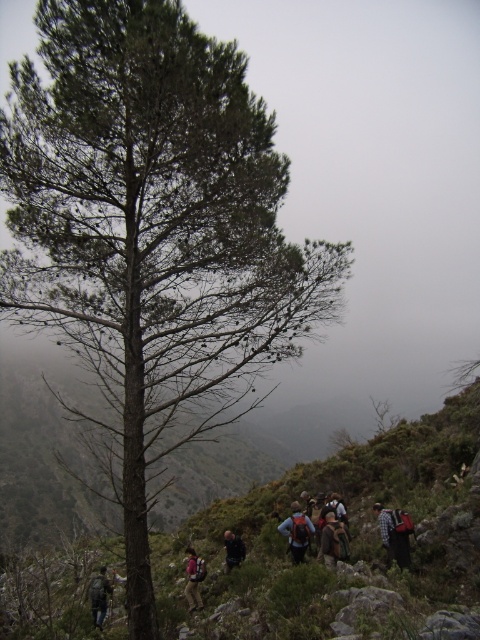
Can you confirm if green rough bark tree at center is wider than red backpack at lower right?

Indeed, green rough bark tree at center has a greater width compared to red backpack at lower right.

What are the coordinates of `green rough bark tree at center` in the screenshot? It's located at (152, 236).

The image size is (480, 640). I want to click on green rough bark tree at center, so click(152, 236).

Who is positioned more to the left, dark blue backpack at center or plaid flannel shirt at lower right?

dark blue backpack at center is more to the left.

Is dark blue backpack at center wider than plaid flannel shirt at lower right?

Yes, dark blue backpack at center is wider than plaid flannel shirt at lower right.

Does point (96, 604) come in front of point (380, 506)?

Yes, it is in front of point (380, 506).

The width and height of the screenshot is (480, 640). I want to click on dark blue backpack at center, so click(x=99, y=596).

The width and height of the screenshot is (480, 640). Describe the element at coordinates (400, 538) in the screenshot. I see `red backpack at lower right` at that location.

Between point (404, 566) and point (382, 506), which one is positioned behind?

The point (382, 506) is more distant.

Image resolution: width=480 pixels, height=640 pixels. In order to click on red backpack at lower right in this screenshot , I will do `click(400, 538)`.